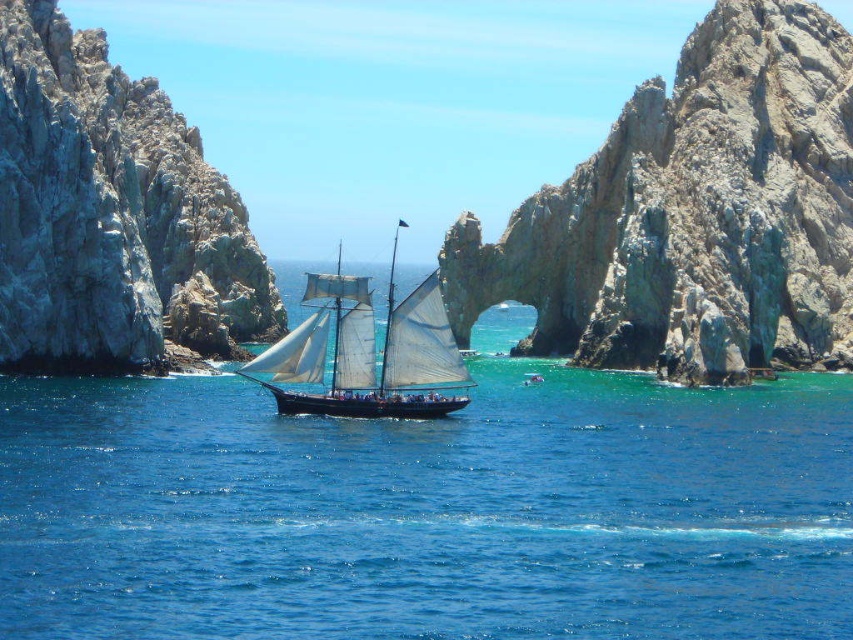
Question: Can you confirm if blue water at center is smaller than white canvas sailboat at center?

Choices:
 (A) no
 (B) yes

Answer: (B)

Question: Among these objects, which one is nearest to the camera?

Choices:
 (A) blue water at center
 (B) white canvas sailboat at center
 (C) rugged stone arch at center
 (D) white rocky cliff at left

Answer: (A)

Question: Which is nearer to the blue water at center?

Choices:
 (A) white canvas sailboat at center
 (B) white rocky cliff at left

Answer: (A)

Question: Does blue water at center have a larger size compared to rugged stone arch at center?

Choices:
 (A) no
 (B) yes

Answer: (A)

Question: Is the position of blue water at center more distant than that of white rocky cliff at left?

Choices:
 (A) no
 (B) yes

Answer: (A)

Question: Estimate the real-world distances between objects in this image. Which object is closer to the white rocky cliff at left?

Choices:
 (A) white canvas sailboat at center
 (B) rugged stone arch at center
 (C) blue water at center

Answer: (C)